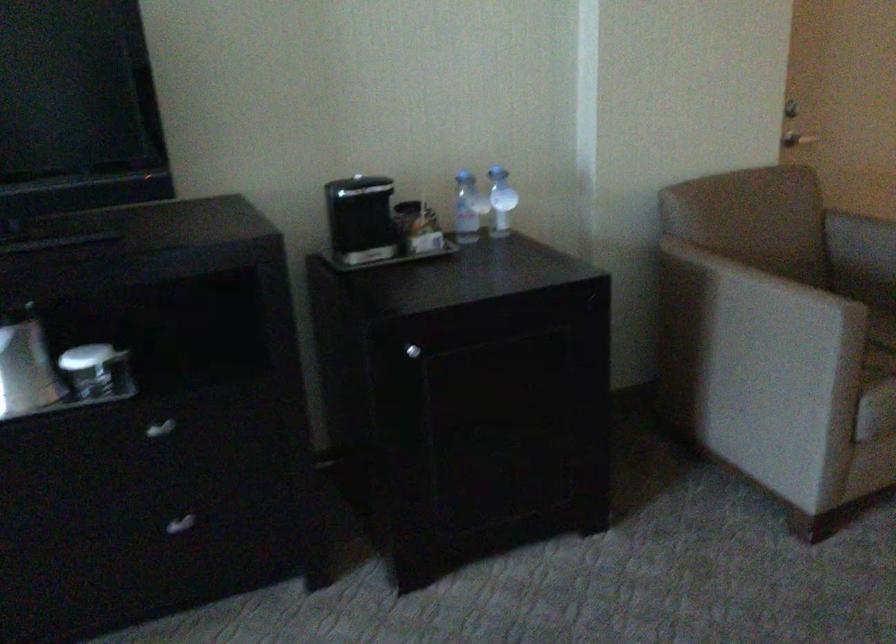
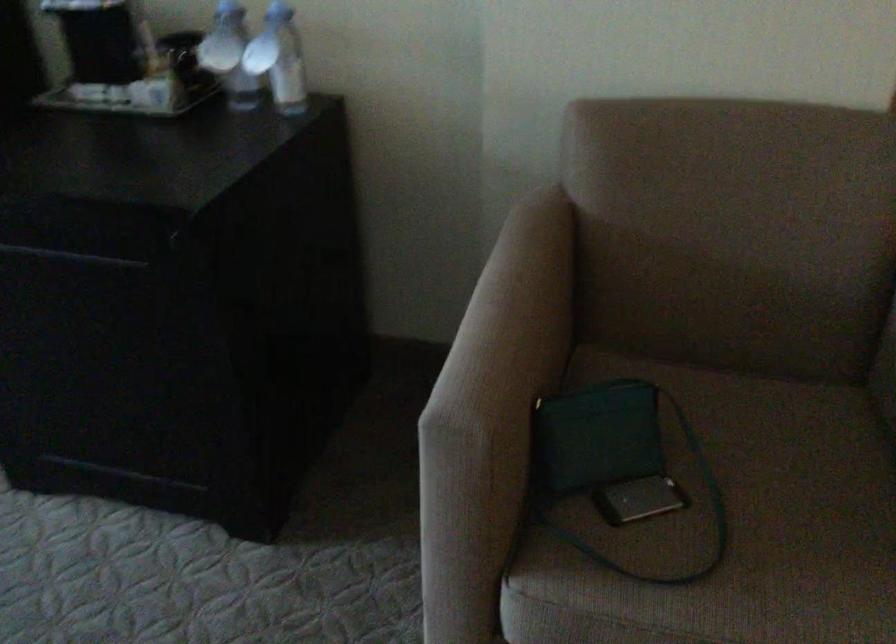
Find the pixel in the second image that matches [500,200] in the first image.

(279, 59)